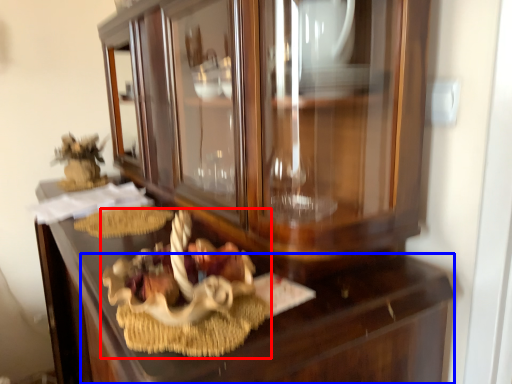
Question: Which point is further to the camera, stuff (highlighted by a red box) or drawer (highlighted by a blue box)?

Choices:
 (A) stuff
 (B) drawer

Answer: (A)